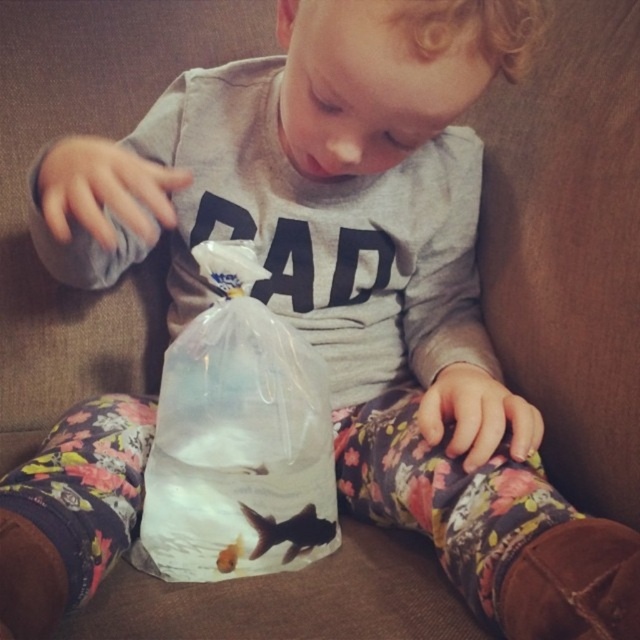
The image size is (640, 640). I want to click on transparent plastic bag at center, so (x=237, y=438).

Who is positioned more to the right, transparent plastic bag at center or translucent plastic goldfish at center?

From the viewer's perspective, transparent plastic bag at center appears more on the right side.

Looking at this image, measure the distance between point (189, 381) and camera.

Point (189, 381) is 26.57 inches away from camera.

This screenshot has height=640, width=640. Find the location of `transparent plastic bag at center`. transparent plastic bag at center is located at coordinates (237, 438).

How distant is black matte fish at center from translucent plastic goldfish at center?

A distance of 1.75 inches exists between black matte fish at center and translucent plastic goldfish at center.

Between black matte fish at center and translucent plastic goldfish at center, which one is positioned higher?

black matte fish at center is above.

The width and height of the screenshot is (640, 640). In order to click on black matte fish at center in this screenshot , I will do `click(289, 531)`.

Where is `black matte fish at center`? black matte fish at center is located at coordinates (289, 531).

Is the position of transparent plastic bag at center less distant than that of black matte fish at center?

Yes, transparent plastic bag at center is in front of black matte fish at center.

Which is more to the right, transparent plastic bag at center or black matte fish at center?

Positioned to the right is black matte fish at center.

What do you see at coordinates (237, 438) in the screenshot? I see `transparent plastic bag at center` at bounding box center [237, 438].

The width and height of the screenshot is (640, 640). Identify the location of transparent plastic bag at center. (237, 438).